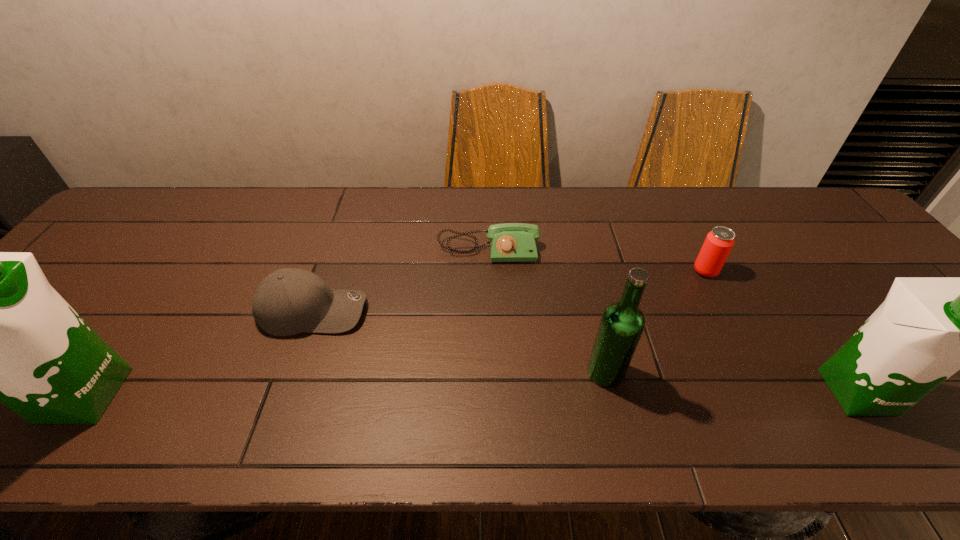
Image resolution: width=960 pixels, height=540 pixels. I want to click on vacant region that satisfies the following two spatial constraints: 1. on the back side of the third object from right to left; 2. on the front brim of the fourth nearest object, so click(591, 311).

Where is `vacant area in the image that satisfies the following two spatial constraints: 1. on the front side of the beer can; 2. on the front-facing side of the taller soya milk`? The width and height of the screenshot is (960, 540). vacant area in the image that satisfies the following two spatial constraints: 1. on the front side of the beer can; 2. on the front-facing side of the taller soya milk is located at coordinates (769, 395).

Where is `vacant space that satisfies the following two spatial constraints: 1. on the back side of the third object from right to left; 2. on the front brim of the third farthest object`? vacant space that satisfies the following two spatial constraints: 1. on the back side of the third object from right to left; 2. on the front brim of the third farthest object is located at coordinates (591, 311).

The image size is (960, 540). Identify the location of free region that satisfies the following two spatial constraints: 1. on the dial of the beer can; 2. on the right side of the shortest object. (490, 271).

The image size is (960, 540). Find the location of `vacant space that satisfies the following two spatial constraints: 1. on the dial of the fourth object from right to left; 2. on the front brim of the second object from left to right`. vacant space that satisfies the following two spatial constraints: 1. on the dial of the fourth object from right to left; 2. on the front brim of the second object from left to right is located at coordinates (490, 311).

The width and height of the screenshot is (960, 540). I want to click on vacant space that satisfies the following two spatial constraints: 1. on the front-facing side of the rightmost object; 2. on the front-facing side of the leftmost object, so click(859, 395).

Locate an element on the screen. This screenshot has width=960, height=540. vacant position in the image that satisfies the following two spatial constraints: 1. on the front-facing side of the shorter soya milk; 2. on the front-facing side of the taller soya milk is located at coordinates (859, 395).

At what (x,y) coordinates should I click in order to perform the action: click on vacant space that satisfies the following two spatial constraints: 1. on the front-facing side of the rightmost object; 2. on the front-facing side of the taller soya milk. Please return your answer as a coordinate pair (x, y). Image resolution: width=960 pixels, height=540 pixels. Looking at the image, I should click on (859, 395).